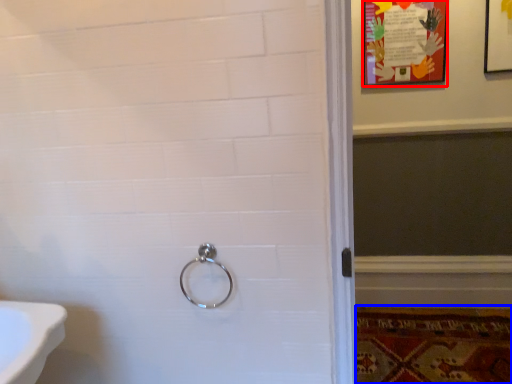
Question: Which object is closer to the camera taking this photo, poster page (highlighted by a red box) or mat (highlighted by a blue box)?

Choices:
 (A) poster page
 (B) mat

Answer: (B)